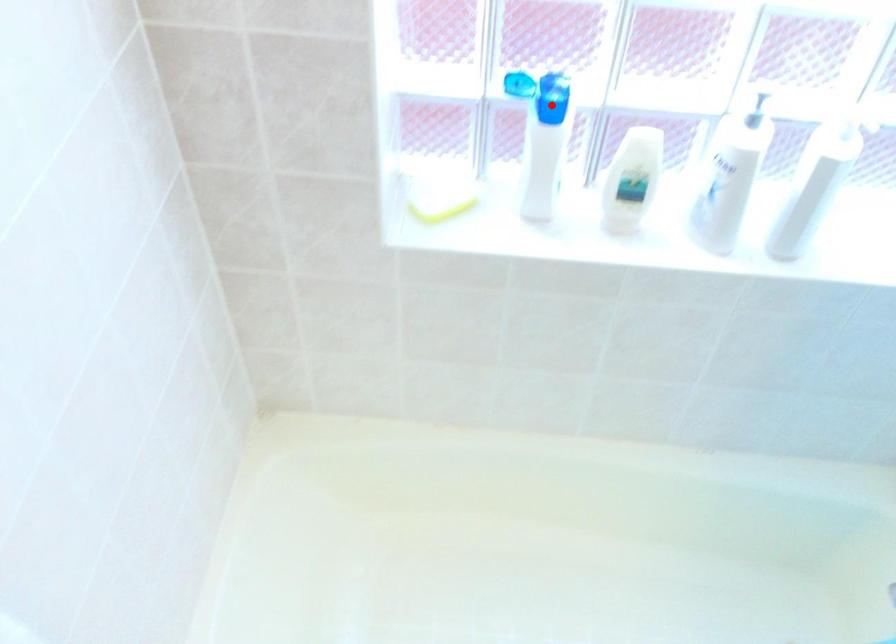
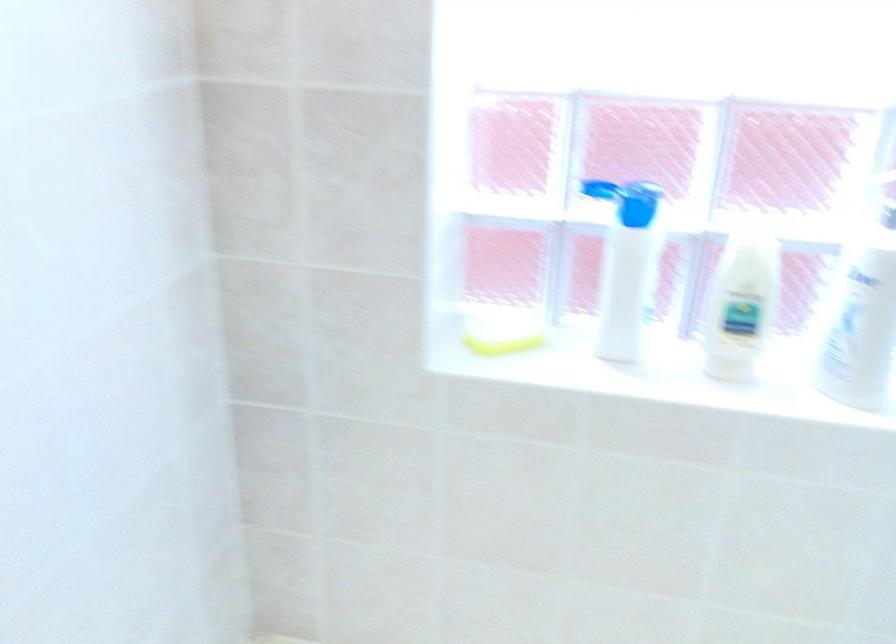
Question: I am providing you with two images of the same scene from different viewpoints. A red point is shown in image1. For the corresponding object point in image2, is it positioned nearer or farther from the camera?

Choices:
 (A) Nearer
 (B) Farther

Answer: (A)